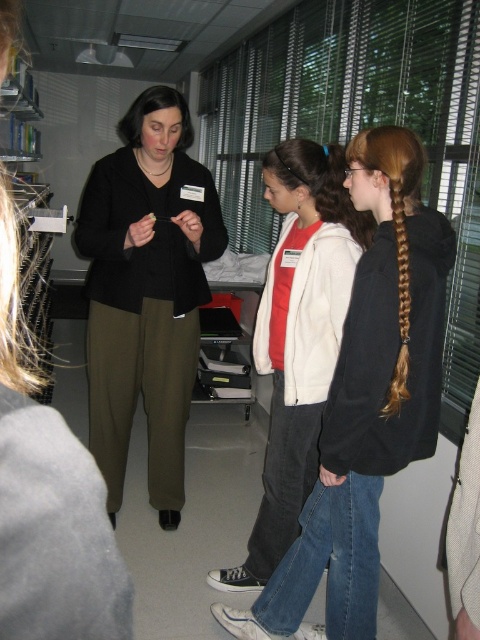
Who is taller, black matte sweater at center or white matte jacket at center?

black matte sweater at center is taller.

Locate an element on the screen. Image resolution: width=480 pixels, height=640 pixels. black matte sweater at center is located at coordinates (145, 292).